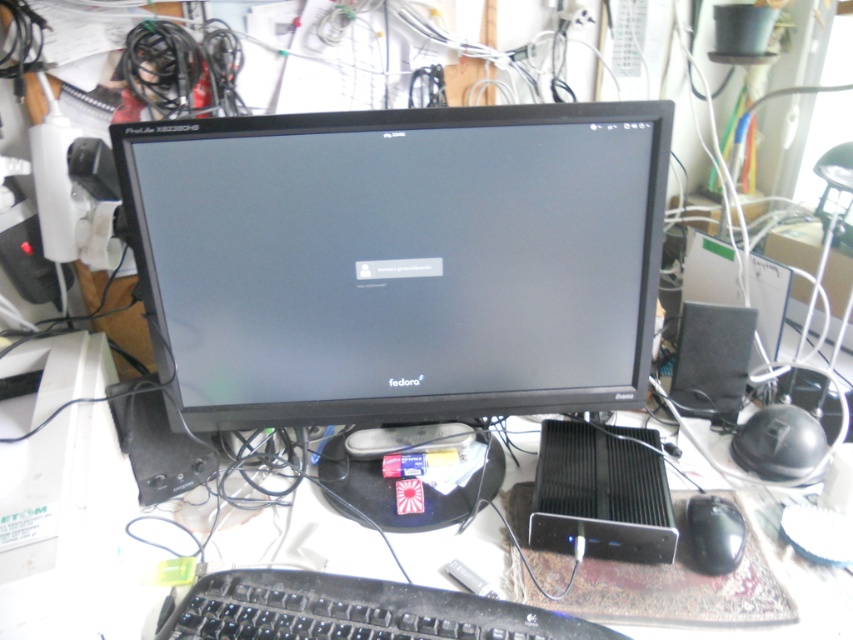
Who is more distant from viewer, (625, 120) or (695, 493)?

The point (695, 493) is behind.

Can you confirm if black matte monitor at center is smaller than black matte mouse at lower right?

Actually, black matte monitor at center might be larger than black matte mouse at lower right.

Who is more distant from viewer, (468, 289) or (718, 502)?

The point (718, 502) is more distant.

At what (x,y) coordinates should I click in order to perform the action: click on black matte monitor at center. Please return your answer as a coordinate pair (x, y). This screenshot has height=640, width=853. Looking at the image, I should click on (399, 260).

Which is below, black matte computer at center or black matte mouse at lower right?

Positioned lower is black matte mouse at lower right.

Is point (602, 496) positioned behind point (703, 541)?

Yes.

This screenshot has width=853, height=640. Identify the location of black matte computer at center. pyautogui.click(x=601, y=493).

Between point (608, 173) and point (642, 467), which one is positioned behind?

Point (642, 467)

Does point (444, 131) come in front of point (622, 512)?

Yes.

Where is `black matte monitor at center`? Image resolution: width=853 pixels, height=640 pixels. black matte monitor at center is located at coordinates (399, 260).